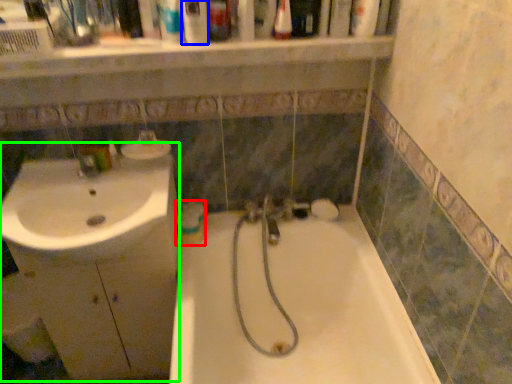
Question: Which is farther away from mouthwash (highlighted by a red box)? mouthwash (highlighted by a blue box) or porcelain (highlighted by a green box)?

Choices:
 (A) mouthwash
 (B) porcelain

Answer: (A)